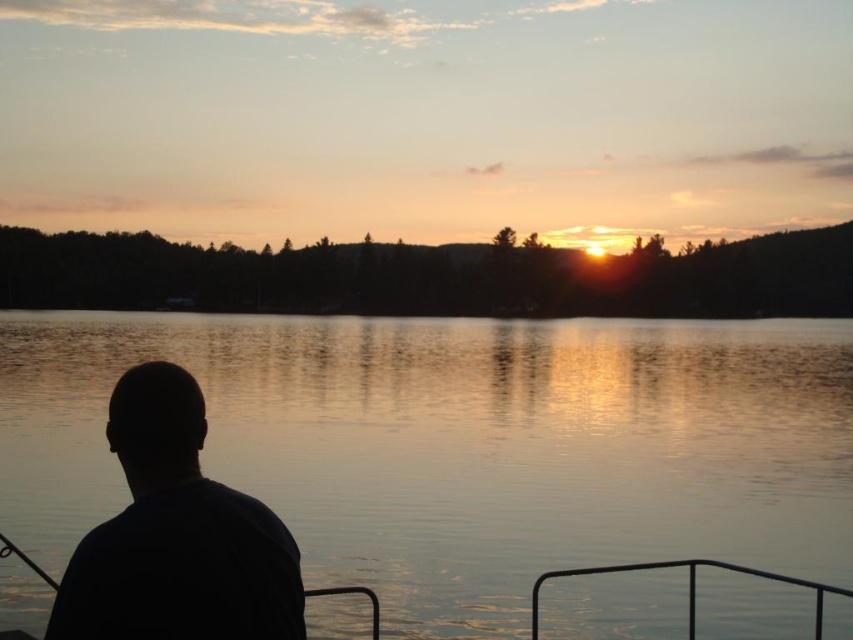
You are standing on the dock and want to know if the silvery water at center is higher than the black metal rail at lower right. Can you confirm this based on the scene?

Yes, the silvery water at center is taller than the black metal rail at lower right according to the description.